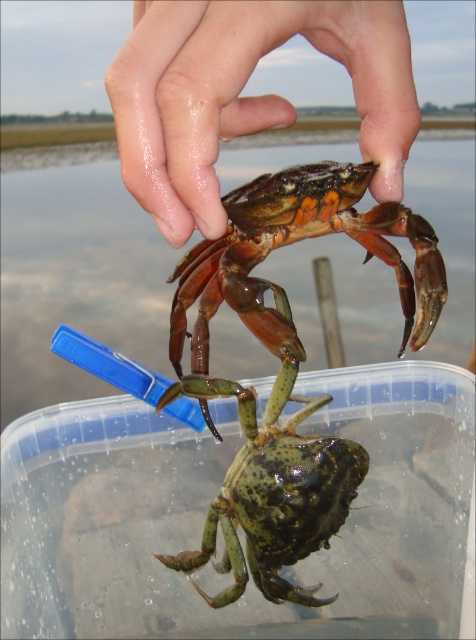
Question: Does glossy skin hand at upper center have a lesser width compared to shiny orange crab at upper center?

Choices:
 (A) yes
 (B) no

Answer: (A)

Question: Does glossy skin hand at upper center have a lesser width compared to shiny orange crab at upper center?

Choices:
 (A) yes
 (B) no

Answer: (A)

Question: Which of the following is the farthest from the observer?

Choices:
 (A) (280, 33)
 (B) (425, 262)

Answer: (B)

Question: In this image, where is glossy skin hand at upper center located relative to shiny orange crab at upper center?

Choices:
 (A) above
 (B) below

Answer: (A)